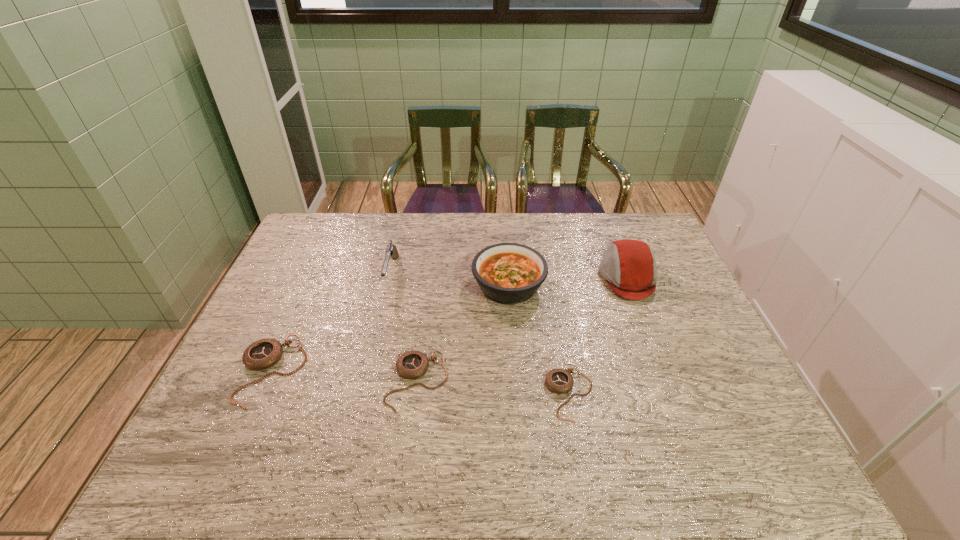
Locate an element on the screen. This screenshot has width=960, height=540. vacant place for an extra pocket watch on the right is located at coordinates (730, 404).